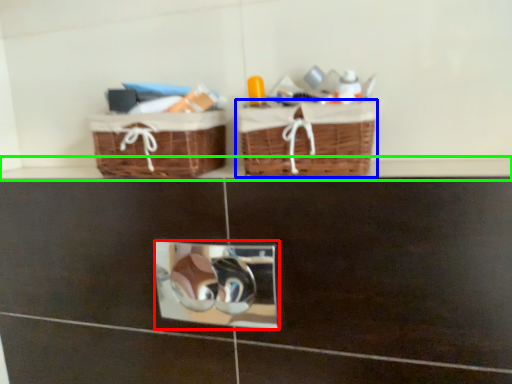
Question: Which is farther away from mirror (highlighted by a red box)? picnic basket (highlighted by a blue box) or ledge (highlighted by a green box)?

Choices:
 (A) picnic basket
 (B) ledge

Answer: (B)